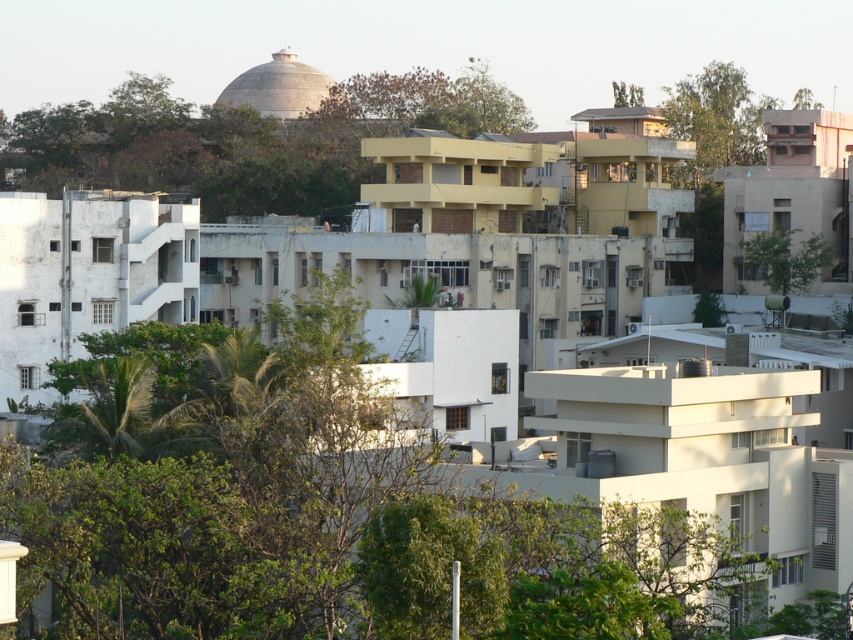
Which is behind, point (300, 115) or point (770, 259)?

The point (300, 115) is behind.

Between brown leafy tree at upper center and green leafy tree at right, which one appears on the right side from the viewer's perspective?

green leafy tree at right

Is point (405, 84) positioned in front of point (798, 252)?

No, (405, 84) is further to viewer.

Identify the location of brown leafy tree at upper center. (248, 140).